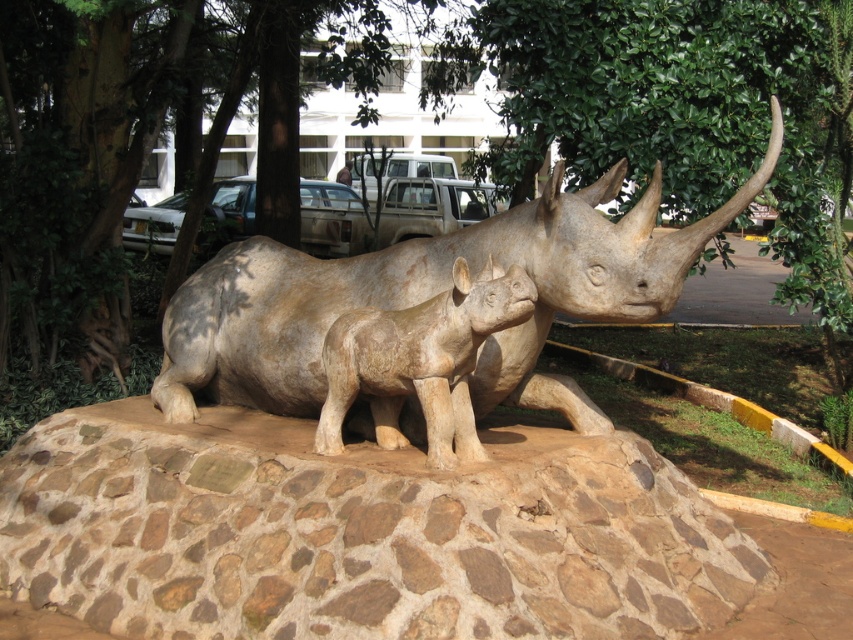
Who is positioned more to the right, brown stone at center or matte beige rhino at center?

Positioned to the right is matte beige rhino at center.

How distant is brown stone at center from matte beige rhino at center?

28.77 inches

Is point (590, 472) less distant than point (389, 384)?

No.

Locate an element on the screen. This screenshot has width=853, height=640. brown stone at center is located at coordinates (358, 532).

Consider the image. Who is positioned more to the right, matte stone rhinoceros at center or matte beige rhino at center?

Positioned to the right is matte stone rhinoceros at center.

Can you confirm if matte stone rhinoceros at center is wider than matte beige rhino at center?

Indeed, matte stone rhinoceros at center has a greater width compared to matte beige rhino at center.

The image size is (853, 640). Describe the element at coordinates (432, 296) in the screenshot. I see `matte stone rhinoceros at center` at that location.

What are the coordinates of `matte stone rhinoceros at center` in the screenshot? It's located at (432, 296).

Who is positioned more to the left, brown stone at center or matte stone rhinoceros at center?

brown stone at center

Describe the element at coordinates (358, 532) in the screenshot. I see `brown stone at center` at that location.

Identify the location of brown stone at center. This screenshot has height=640, width=853. (358, 532).